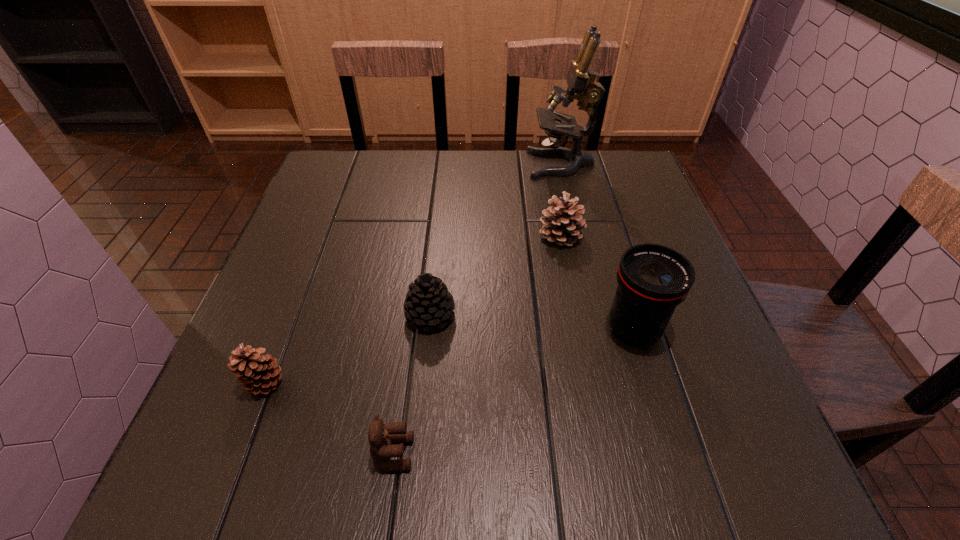
Find the location of `vacant region located at the eyepieces of the farthest object`. vacant region located at the eyepieces of the farthest object is located at coordinates (468, 164).

I want to click on free space located 0.250m at the eyepieces of the farthest object, so click(440, 164).

Identify the location of vacant position located on the back of the telephoto lens. (612, 261).

Locate an element on the screen. This screenshot has width=960, height=540. vacant region located on the front of the rightmost pinecone is located at coordinates (595, 411).

Where is `vacant space located 0.120m at the narrow end of the second farthest pinecone`? vacant space located 0.120m at the narrow end of the second farthest pinecone is located at coordinates (422, 392).

This screenshot has height=540, width=960. What are the coordinates of `free space located on the front of the leftmost pinecone` in the screenshot? It's located at (234, 461).

At what (x,y) coordinates should I click in order to perform the action: click on vacant space located 0.160m on the face of the teddy bear. Please return your answer as a coordinate pair (x, y). The width and height of the screenshot is (960, 540). Looking at the image, I should click on 516,454.

Locate an element on the screen. object located in the far edge section of the desktop is located at coordinates (580, 79).

The height and width of the screenshot is (540, 960). I want to click on object located at the near edge, so click(380, 436).

Find the location of `object that is at the left edge`. object that is at the left edge is located at coordinates (257, 373).